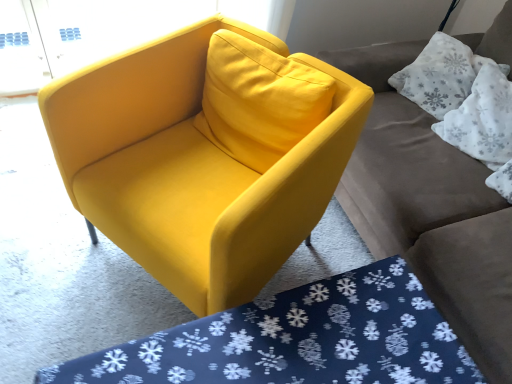
Based on the photo, measure the distance between white textured pillow at upper right, the 2th pillow positioned from the bottom, and camera.

white textured pillow at upper right, the 2th pillow positioned from the bottom, and camera are 1.61 meters apart.

Describe the element at coordinates (483, 118) in the screenshot. I see `white fabric pillow at upper right, placed as the 2th pillow when sorted from top to bottom` at that location.

Where is `white fabric pillow at upper right, the first pillow in the bottom-to-top sequence`? The width and height of the screenshot is (512, 384). white fabric pillow at upper right, the first pillow in the bottom-to-top sequence is located at coordinates (483, 118).

Describe the element at coordinates (430, 209) in the screenshot. I see `matte gray couch at upper right` at that location.

Locate an element on the screen. white textured pillow at upper right, the 2th pillow positioned from the bottom is located at coordinates (441, 75).

Is the depth of white fabric pillow at upper right, placed as the 2th pillow when sorted from top to bottom, greater than that of matte gray couch at upper right?

Yes, white fabric pillow at upper right, placed as the 2th pillow when sorted from top to bottom, is behind matte gray couch at upper right.

Considering the relative sizes of white fabric pillow at upper right, placed as the 2th pillow when sorted from top to bottom, and matte gray couch at upper right in the image provided, is white fabric pillow at upper right, placed as the 2th pillow when sorted from top to bottom, bigger than matte gray couch at upper right?

Actually, white fabric pillow at upper right, placed as the 2th pillow when sorted from top to bottom, might be smaller than matte gray couch at upper right.

Which is in front, point (511, 100) or point (454, 235)?

The point (454, 235) is more forward.

Considering the relative positions of white fabric pillow at upper right, placed as the 2th pillow when sorted from top to bottom, and matte gray couch at upper right in the image provided, is white fabric pillow at upper right, placed as the 2th pillow when sorted from top to bottom, to the left or to the right of matte gray couch at upper right?

white fabric pillow at upper right, placed as the 2th pillow when sorted from top to bottom, is to the right of matte gray couch at upper right.

Is matte gray couch at upper right oriented towards white fabric pillow at upper right, placed as the 2th pillow when sorted from top to bottom?

Yes, matte gray couch at upper right faces towards white fabric pillow at upper right, placed as the 2th pillow when sorted from top to bottom.

From a real-world perspective, is matte gray couch at upper right below white fabric pillow at upper right, placed as the 2th pillow when sorted from top to bottom?

Yes.

Is the surface of matte gray couch at upper right in direct contact with white fabric pillow at upper right, placed as the 2th pillow when sorted from top to bottom?

matte gray couch at upper right is not next to white fabric pillow at upper right, placed as the 2th pillow when sorted from top to bottom, and they're not touching.

How many degrees apart are the facing directions of white fabric pillow at upper right, the first pillow in the bottom-to-top sequence, and blue snowflake-patterned mat at lower center?

white fabric pillow at upper right, the first pillow in the bottom-to-top sequence, and blue snowflake-patterned mat at lower center are facing 20.6 degrees away from each other.

Is white fabric pillow at upper right, placed as the 2th pillow when sorted from top to bottom, positioned before blue snowflake-patterned mat at lower center?

No, white fabric pillow at upper right, placed as the 2th pillow when sorted from top to bottom, is behind blue snowflake-patterned mat at lower center.

Is blue snowflake-patterned mat at lower center at the back of white fabric pillow at upper right, the first pillow in the bottom-to-top sequence?

No, white fabric pillow at upper right, the first pillow in the bottom-to-top sequence, is not facing the opposite direction of blue snowflake-patterned mat at lower center.

From the image's perspective, between white fabric pillow at upper right, placed as the 2th pillow when sorted from top to bottom, and blue snowflake-patterned mat at lower center, who is located below?

blue snowflake-patterned mat at lower center appears lower in the image.

Does point (479, 94) come in front of point (446, 96)?

Yes, it is.

Does white fabric pillow at upper right, placed as the 2th pillow when sorted from top to bottom, lie in front of white textured pillow at upper right, the 2th pillow positioned from the bottom?

Yes, the depth of white fabric pillow at upper right, placed as the 2th pillow when sorted from top to bottom, is less than that of white textured pillow at upper right, the 2th pillow positioned from the bottom.

Could you tell me if white fabric pillow at upper right, placed as the 2th pillow when sorted from top to bottom, is turned towards white textured pillow at upper right, the 2th pillow positioned from the bottom?

No, white fabric pillow at upper right, placed as the 2th pillow when sorted from top to bottom, does not turn towards white textured pillow at upper right, the 2th pillow positioned from the bottom.

From a real-world perspective, who is located lower, white fabric pillow at upper right, the first pillow in the bottom-to-top sequence, or white textured pillow at upper right, acting as the first pillow starting from the top?

white textured pillow at upper right, acting as the first pillow starting from the top, from a real-world perspective.

Considering the sizes of objects blue snowflake-patterned mat at lower center and matte yellow armchair at center in the image provided, who is wider, blue snowflake-patterned mat at lower center or matte yellow armchair at center?

With larger width is blue snowflake-patterned mat at lower center.

Is blue snowflake-patterned mat at lower center taller than matte yellow armchair at center?

No.

Consider the image. From the image's perspective, is blue snowflake-patterned mat at lower center positioned above or below matte yellow armchair at center?

From the image's perspective, blue snowflake-patterned mat at lower center appears below matte yellow armchair at center.

Is blue snowflake-patterned mat at lower center bigger or smaller than matte yellow armchair at center?

Considering their sizes, blue snowflake-patterned mat at lower center takes up less space than matte yellow armchair at center.

Could you tell me if blue snowflake-patterned mat at lower center is turned towards white textured pillow at upper right, the 2th pillow positioned from the bottom?

No, blue snowflake-patterned mat at lower center is not facing towards white textured pillow at upper right, the 2th pillow positioned from the bottom.

Which object is positioned more to the left, blue snowflake-patterned mat at lower center or white textured pillow at upper right, the 2th pillow positioned from the bottom?

From the viewer's perspective, blue snowflake-patterned mat at lower center appears more on the left side.

From a real-world perspective, is blue snowflake-patterned mat at lower center above or below white textured pillow at upper right, acting as the first pillow starting from the top?

Clearly, from a real-world perspective, blue snowflake-patterned mat at lower center is below white textured pillow at upper right, acting as the first pillow starting from the top.

Is matte yellow armchair at center oriented towards white fabric pillow at upper right, the first pillow in the bottom-to-top sequence?

No, matte yellow armchair at center is not oriented towards white fabric pillow at upper right, the first pillow in the bottom-to-top sequence.

From a real-world perspective, which object rests below the other?

From a 3D spatial view, matte yellow armchair at center is below.

Considering the sizes of matte yellow armchair at center and white fabric pillow at upper right, the first pillow in the bottom-to-top sequence, in the image, is matte yellow armchair at center wider or thinner than white fabric pillow at upper right, the first pillow in the bottom-to-top sequence,?

Clearly, matte yellow armchair at center has more width compared to white fabric pillow at upper right, the first pillow in the bottom-to-top sequence.

Looking at this image, how many degrees apart are the facing directions of matte yellow armchair at center and white fabric pillow at upper right, the first pillow in the bottom-to-top sequence?

There is a 8.5-degree angle between the facing directions of matte yellow armchair at center and white fabric pillow at upper right, the first pillow in the bottom-to-top sequence.

From a real-world perspective, which pillow is the 2nd one above the matte gray couch at upper right? Please provide its 2D coordinates.

[(483, 118)]

Find the location of `pillow that is on the right side of matte gray couch at upper right`. pillow that is on the right side of matte gray couch at upper right is located at coordinates (483, 118).

When comparing their distances from white fabric pillow at upper right, placed as the 2th pillow when sorted from top to bottom, does white textured pillow at upper right, acting as the first pillow starting from the top, or matte gray couch at upper right seem closer?

white textured pillow at upper right, acting as the first pillow starting from the top, lies closer to white fabric pillow at upper right, placed as the 2th pillow when sorted from top to bottom, than the other object.

Based on their spatial positions, is blue snowflake-patterned mat at lower center or white textured pillow at upper right, acting as the first pillow starting from the top, further from matte gray couch at upper right?

Based on the image, blue snowflake-patterned mat at lower center appears to be further to matte gray couch at upper right.

Looking at the image, which one is located closer to matte gray couch at upper right, white textured pillow at upper right, acting as the first pillow starting from the top, or white fabric pillow at upper right, placed as the 2th pillow when sorted from top to bottom?

The object closer to matte gray couch at upper right is white fabric pillow at upper right, placed as the 2th pillow when sorted from top to bottom.

Which object lies further to the anchor point white fabric pillow at upper right, placed as the 2th pillow when sorted from top to bottom, matte yellow armchair at center or matte gray couch at upper right?

matte yellow armchair at center lies further to white fabric pillow at upper right, placed as the 2th pillow when sorted from top to bottom, than the other object.

Which object lies nearer to the anchor point matte gray couch at upper right, white textured pillow at upper right, acting as the first pillow starting from the top, or blue snowflake-patterned mat at lower center?

white textured pillow at upper right, acting as the first pillow starting from the top, is closer to matte gray couch at upper right.

Which object lies nearer to the anchor point white textured pillow at upper right, the 2th pillow positioned from the bottom, matte yellow armchair at center or blue snowflake-patterned mat at lower center?

matte yellow armchair at center.

From the image, which object appears to be nearer to white fabric pillow at upper right, placed as the 2th pillow when sorted from top to bottom, white textured pillow at upper right, acting as the first pillow starting from the top, or matte yellow armchair at center?

white textured pillow at upper right, acting as the first pillow starting from the top, is positioned closer to the anchor white fabric pillow at upper right, placed as the 2th pillow when sorted from top to bottom.

When comparing their distances from blue snowflake-patterned mat at lower center, does matte yellow armchair at center or white fabric pillow at upper right, the first pillow in the bottom-to-top sequence, seem closer?

matte yellow armchair at center.

The width and height of the screenshot is (512, 384). Find the location of `pillow between matte gray couch at upper right and white textured pillow at upper right, acting as the first pillow starting from the top, from front to back`. pillow between matte gray couch at upper right and white textured pillow at upper right, acting as the first pillow starting from the top, from front to back is located at coordinates (483, 118).

Where is `pillow situated between matte yellow armchair at center and matte gray couch at upper right from left to right`? pillow situated between matte yellow armchair at center and matte gray couch at upper right from left to right is located at coordinates (441, 75).

Locate an element on the screen. This screenshot has width=512, height=384. mat located between matte yellow armchair at center and white fabric pillow at upper right, the first pillow in the bottom-to-top sequence, in the left-right direction is located at coordinates (x=297, y=340).

Where is `pillow situated between matte yellow armchair at center and white fabric pillow at upper right, the first pillow in the bottom-to-top sequence, from left to right`? Image resolution: width=512 pixels, height=384 pixels. pillow situated between matte yellow armchair at center and white fabric pillow at upper right, the first pillow in the bottom-to-top sequence, from left to right is located at coordinates (441, 75).